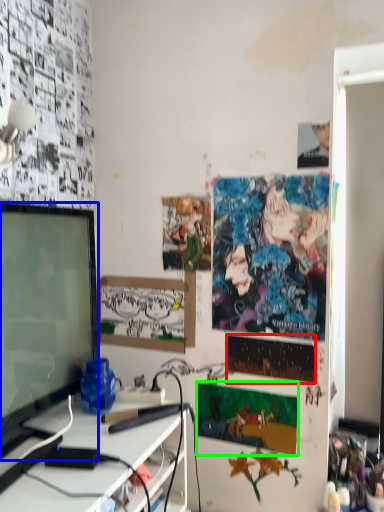
Question: Based on their relative distances, which object is farther from poster page (highlighted by a red box)? Choose from television (highlighted by a blue box) and poster page (highlighted by a green box).

Choices:
 (A) television
 (B) poster page

Answer: (A)